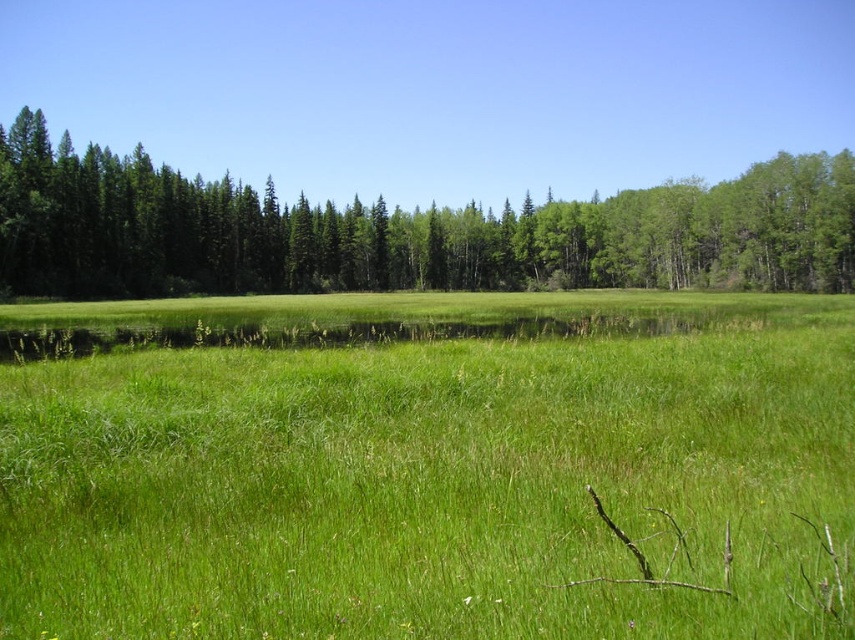
Question: Does green grassy field at center appear over green matte trees at center?

Choices:
 (A) no
 (B) yes

Answer: (A)

Question: Which of the following is the closest to the observer?

Choices:
 (A) green grassy field at center
 (B) green matte trees at center

Answer: (A)

Question: Is green grassy field at center positioned at the back of green matte trees at center?

Choices:
 (A) yes
 (B) no

Answer: (B)

Question: Which of the following is the closest to the observer?

Choices:
 (A) green grassy field at center
 (B) green matte trees at center

Answer: (A)

Question: Can you confirm if green grassy field at center is smaller than green matte trees at center?

Choices:
 (A) yes
 (B) no

Answer: (A)